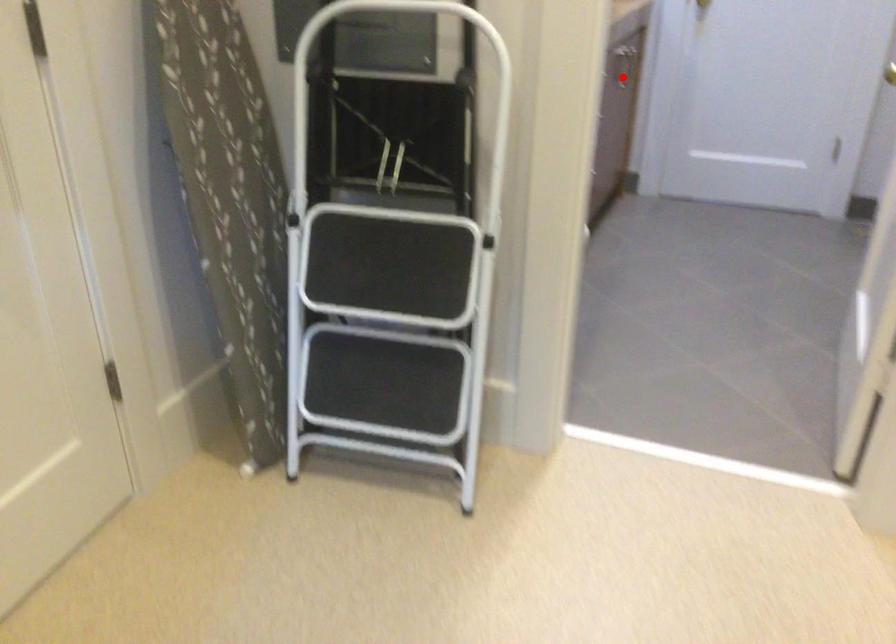
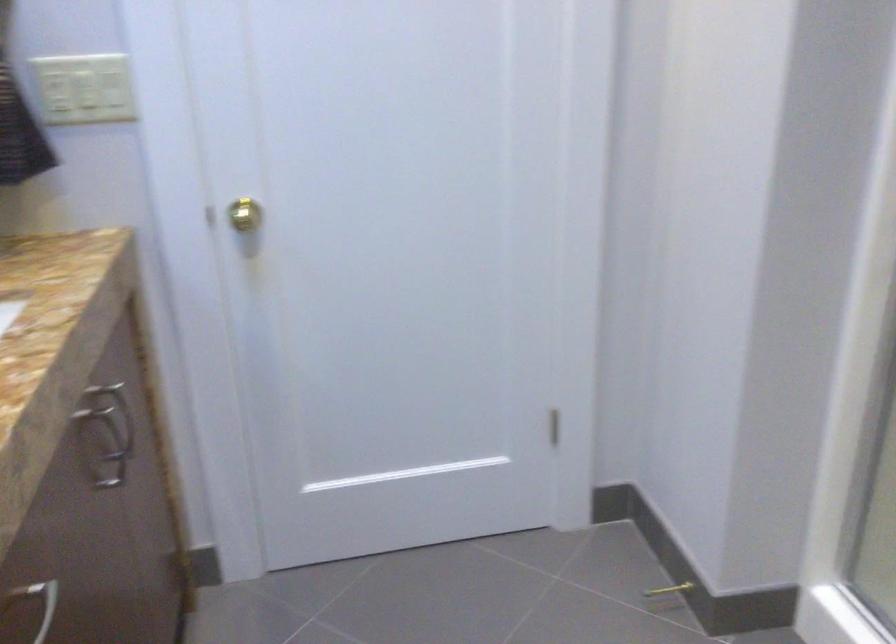
In the second image, find the point that corresponds to the highlighted location in the first image.

(113, 453)